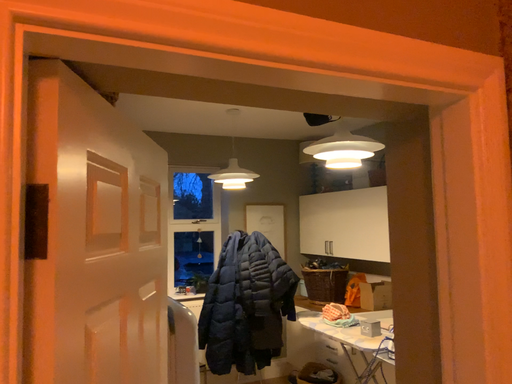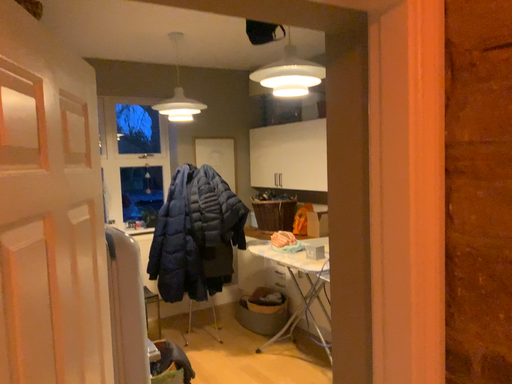
Question: How did the camera likely rotate when shooting the video?

Choices:
 (A) rotated left
 (B) rotated right

Answer: (B)